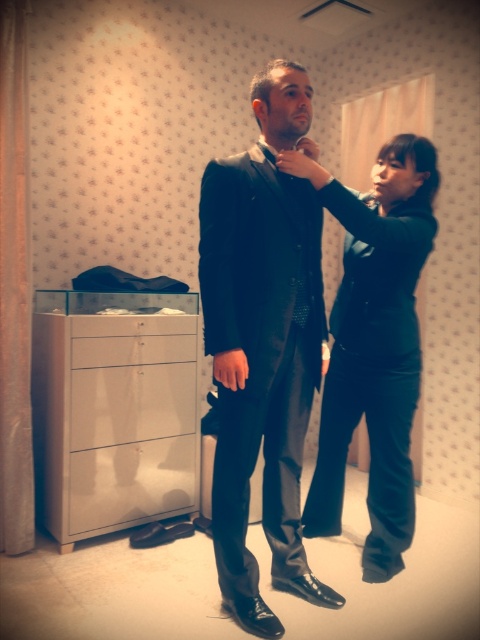
Who is lower down, black shiny suit at center or white glossy/file cabinet at lower left?

white glossy/file cabinet at lower left

Is black shiny suit at center thinner than white glossy/file cabinet at lower left?

Yes.

The width and height of the screenshot is (480, 640). What do you see at coordinates (263, 342) in the screenshot? I see `black shiny suit at center` at bounding box center [263, 342].

At what (x,y) coordinates should I click in order to perform the action: click on black shiny suit at center. Please return your answer as a coordinate pair (x, y). This screenshot has height=640, width=480. Looking at the image, I should click on (263, 342).

Is the position of black shiny suit at center less distant than that of velvet black pants at center?

Yes, it is.

Which is more to the left, black shiny suit at center or velvet black pants at center?

Positioned to the left is black shiny suit at center.

Is point (224, 160) closer to camera compared to point (319, 524)?

That is True.

This screenshot has width=480, height=640. Find the location of `black shiny suit at center`. black shiny suit at center is located at coordinates (263, 342).

Looking at this image, does white glossy/file cabinet at lower left lie in front of velvet black pants at center?

That is False.

Can you confirm if white glossy/file cabinet at lower left is bigger than velvet black pants at center?

Indeed, white glossy/file cabinet at lower left has a larger size compared to velvet black pants at center.

Image resolution: width=480 pixels, height=640 pixels. I want to click on white glossy/file cabinet at lower left, so click(113, 410).